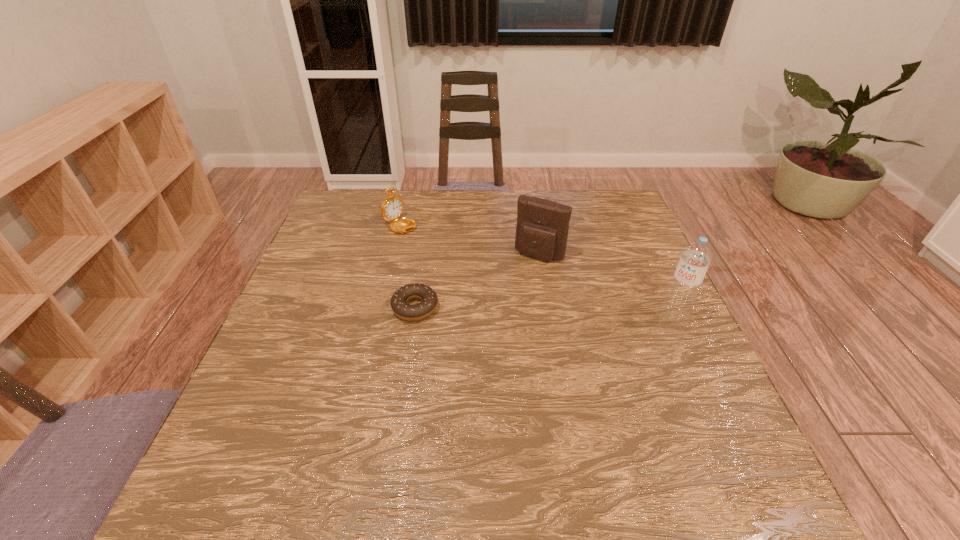
Where is `vacant spot on the desktop that is between the shortest object and the tallest object and is positioned with an open flap on the second object from right to left`? The image size is (960, 540). vacant spot on the desktop that is between the shortest object and the tallest object and is positioned with an open flap on the second object from right to left is located at coordinates (507, 310).

Where is `free space on the desktop that is between the doughnut and the rightmost object and is positioned on the face of the farthest object`? The image size is (960, 540). free space on the desktop that is between the doughnut and the rightmost object and is positioned on the face of the farthest object is located at coordinates (561, 312).